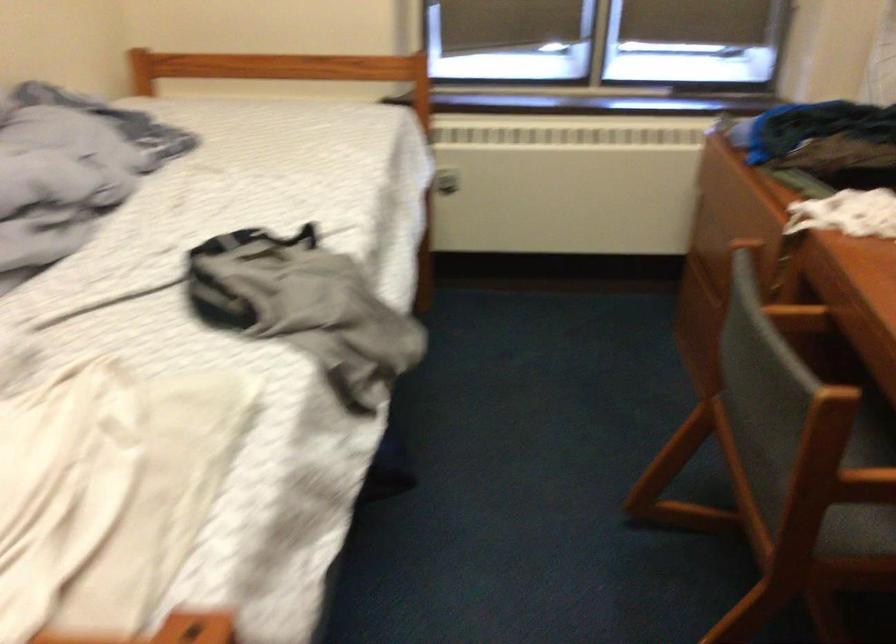
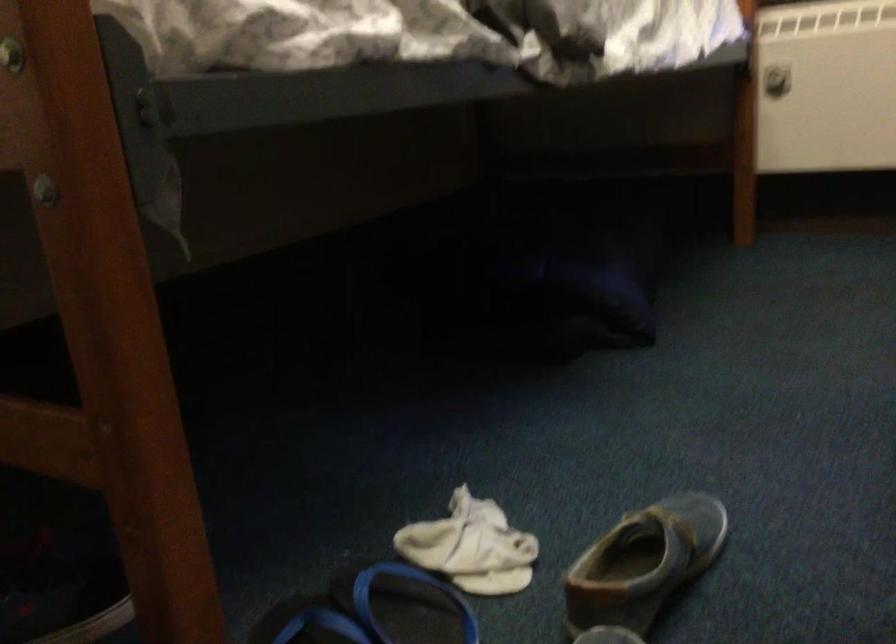
Question: The first image is from the beginning of the video and the second image is from the end. How did the camera likely rotate when shooting the video?

Choices:
 (A) Left
 (B) Right
 (C) Up
 (D) Down

Answer: (A)